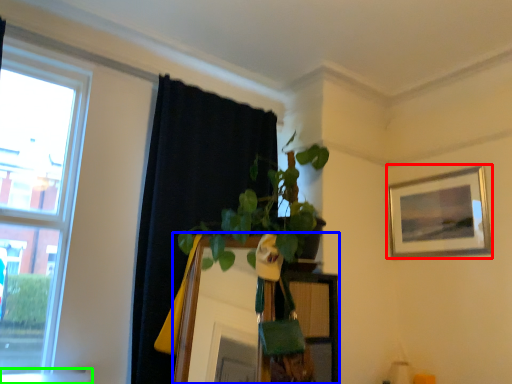
Question: Which is nearer to the picture frame (highlighted by a red box)? mirror (highlighted by a blue box) or window sill (highlighted by a green box).

Choices:
 (A) mirror
 (B) window sill

Answer: (A)